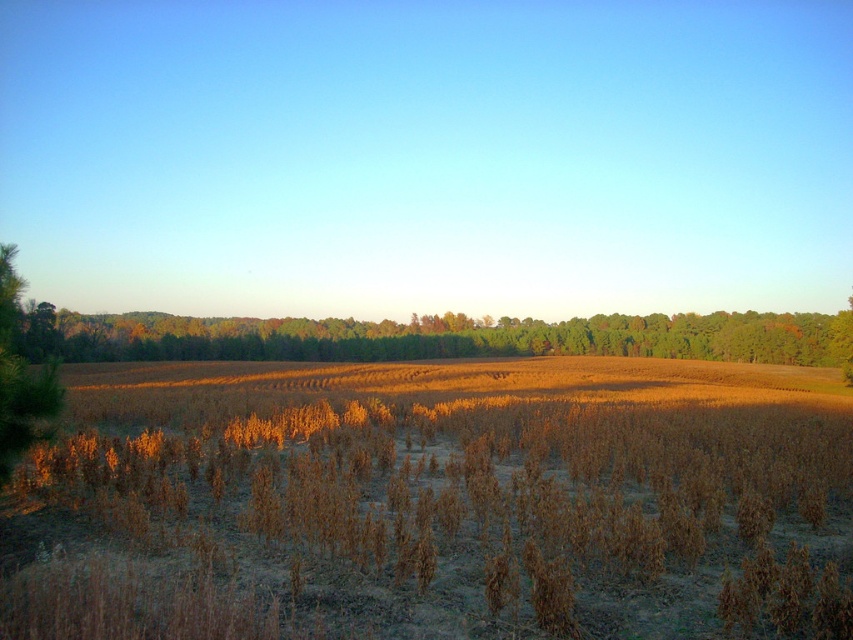
You are standing in the middle of a harvested field and see the brown dry wheat at center and the brown textured field at center. Which object is nearer to you?

The brown dry wheat at center is closer to the viewer than the brown textured field at center.

You are standing in the middle of the harvested soybean field and see two points marked in the image. Which point, point (543, 604) or point (1, 365), is closer to you?

Point (543, 604) is closer to you than point (1, 365).